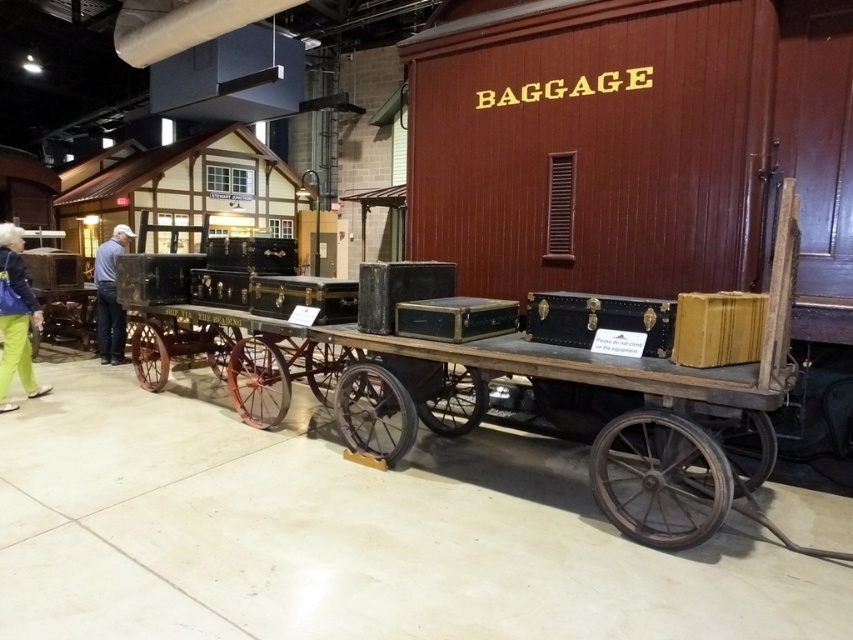
Question: Does green fabric bag at lower left have a lesser width compared to blue jeans at left?

Choices:
 (A) no
 (B) yes

Answer: (B)

Question: Does green fabric bag at lower left have a larger size compared to blue jeans at left?

Choices:
 (A) no
 (B) yes

Answer: (A)

Question: Which point is closer to the camera taking this photo?

Choices:
 (A) (113, 321)
 (B) (1, 316)

Answer: (B)

Question: Which point is closer to the camera taking this photo?

Choices:
 (A) (96, 266)
 (B) (18, 314)

Answer: (B)

Question: Can you confirm if green fabric bag at lower left is wider than blue jeans at left?

Choices:
 (A) yes
 (B) no

Answer: (B)